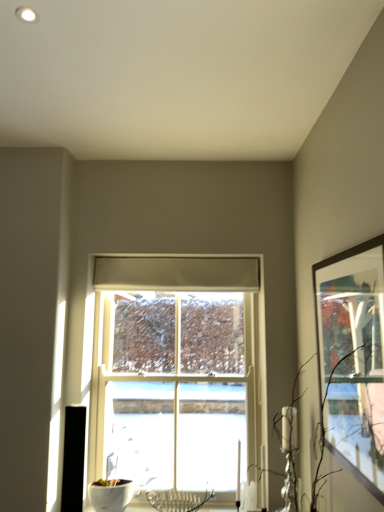
Question: Is brown matte branch at right wider than white wooden window at center?

Choices:
 (A) yes
 (B) no

Answer: (A)

Question: Is brown matte branch at right closer to camera compared to white wooden window at center?

Choices:
 (A) yes
 (B) no

Answer: (A)

Question: Is brown matte branch at right oriented towards white wooden window at center?

Choices:
 (A) yes
 (B) no

Answer: (B)

Question: Considering the relative sizes of brown matte branch at right and white wooden window at center in the image provided, is brown matte branch at right taller than white wooden window at center?

Choices:
 (A) no
 (B) yes

Answer: (A)

Question: Is there a large distance between brown matte branch at right and white wooden window at center?

Choices:
 (A) yes
 (B) no

Answer: (A)

Question: Is white wooden window at center to the left or to the right of matte black picture frame at right in the image?

Choices:
 (A) right
 (B) left

Answer: (B)

Question: In the image, is white wooden window at center positioned in front of or behind matte black picture frame at right?

Choices:
 (A) front
 (B) behind

Answer: (B)

Question: From a real-world perspective, is white wooden window at center positioned above or below matte black picture frame at right?

Choices:
 (A) above
 (B) below

Answer: (B)

Question: Is point (119, 309) closer or farther from the camera than point (334, 400)?

Choices:
 (A) farther
 (B) closer

Answer: (A)

Question: Considering the positions of point (319, 431) and point (264, 314), is point (319, 431) closer or farther from the camera than point (264, 314)?

Choices:
 (A) farther
 (B) closer

Answer: (B)

Question: From a real-world perspective, relative to white wooden window at center, is brown matte branch at right vertically above or below?

Choices:
 (A) below
 (B) above

Answer: (A)

Question: Would you say brown matte branch at right is to the left or to the right of white wooden window at center in the picture?

Choices:
 (A) left
 (B) right

Answer: (B)

Question: From the image's perspective, is brown matte branch at right located above or below white wooden window at center?

Choices:
 (A) above
 (B) below

Answer: (A)

Question: Is brown matte branch at right situated inside matte black picture frame at right or outside?

Choices:
 (A) outside
 (B) inside

Answer: (A)

Question: From their relative heights in the image, would you say brown matte branch at right is taller or shorter than matte black picture frame at right?

Choices:
 (A) tall
 (B) short

Answer: (B)